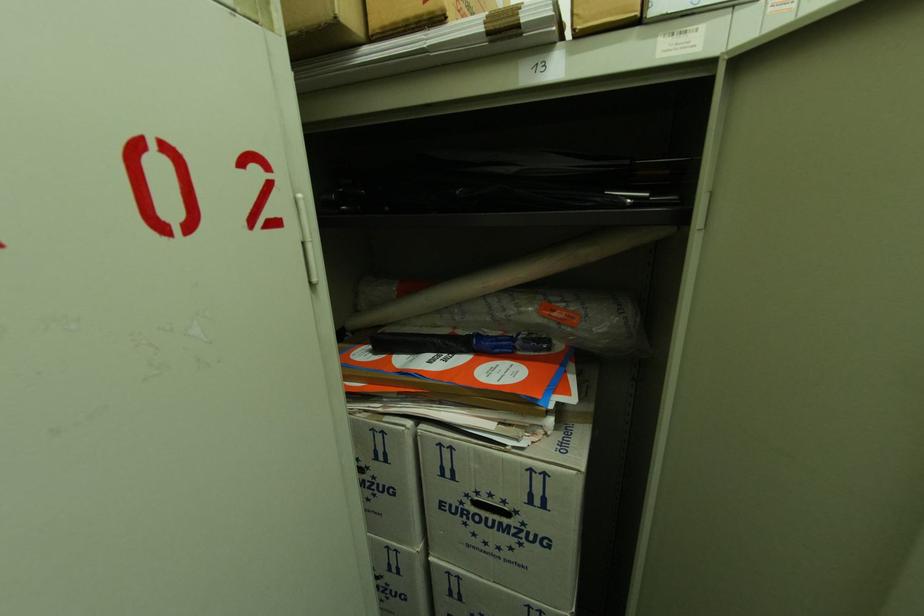
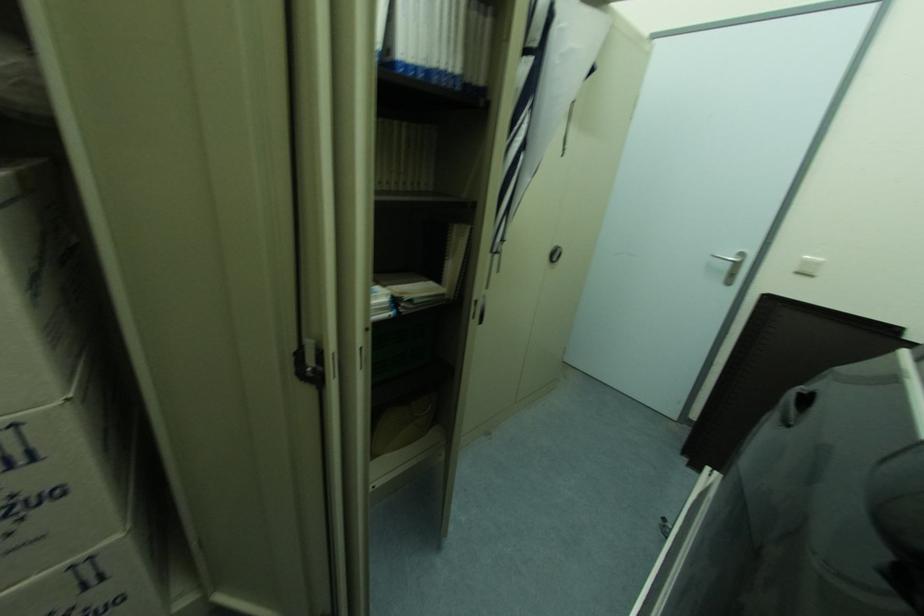
Question: The camera is either moving clockwise (left) or counter-clockwise (right) around the object. The first image is from the beginning of the video and the second image is from the end. Is the camera moving left or right when shooting the video?

Choices:
 (A) Left
 (B) Right

Answer: (A)